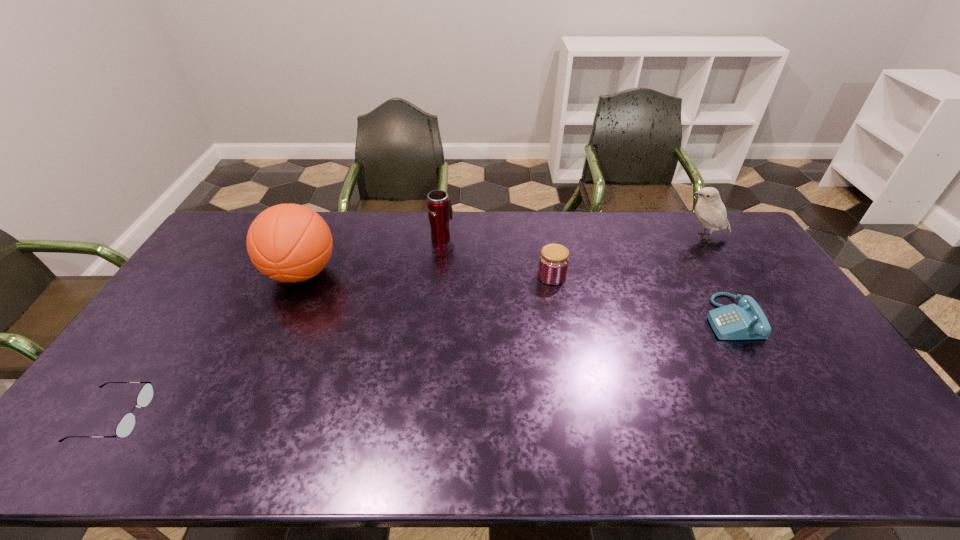
At what (x,y) coordinates should I click in order to perform the action: click on the fifth object from right to left. Please return your answer as a coordinate pair (x, y). Looking at the image, I should click on click(290, 243).

Image resolution: width=960 pixels, height=540 pixels. What are the coordinates of `basketball` in the screenshot? It's located at (290, 243).

This screenshot has width=960, height=540. Identify the location of bird. (710, 210).

This screenshot has width=960, height=540. I want to click on thermos bottle, so tap(440, 212).

The image size is (960, 540). Find the location of `the third object from right to left`. the third object from right to left is located at coordinates (554, 259).

The height and width of the screenshot is (540, 960). What are the coordinates of `jam` in the screenshot? It's located at click(x=554, y=259).

At what (x,y) coordinates should I click in order to perform the action: click on the fifth tallest object. Please return your answer as a coordinate pair (x, y). Image resolution: width=960 pixels, height=540 pixels. Looking at the image, I should click on (746, 321).

Find the location of a particular element. the nearest object is located at coordinates (126, 425).

The image size is (960, 540). I want to click on the shortest object, so click(x=126, y=425).

Find the location of a particular element. free region located on the back of the second object from left to right is located at coordinates (323, 226).